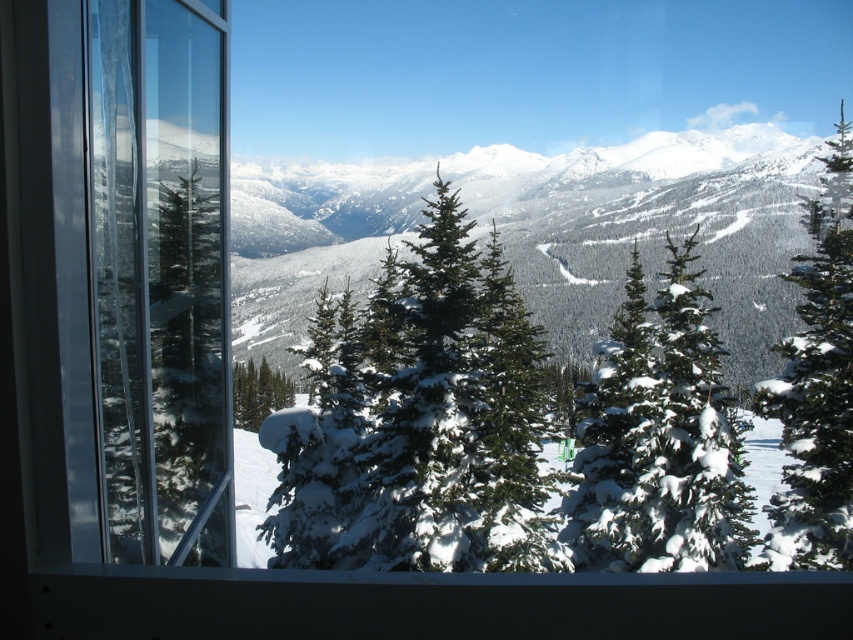
You are an architect designing a winter landscape scene and want to place both the green textured pine tree at center and the green matte tree at center in your design. According to the image, which tree should be placed higher up in your composition?

The green textured pine tree at center should be placed higher up in the composition because it is positioned above the green matte tree at center in the image.

You are standing in a cabin with a large window. You notice a specific point marked at coordinates point (602, 458) in the snowy mountain view outside. If you want to estimate how far that point is from you, what would be the approximate distance?

The point (602, 458) is approximately 22.98 meters away from the viewer.